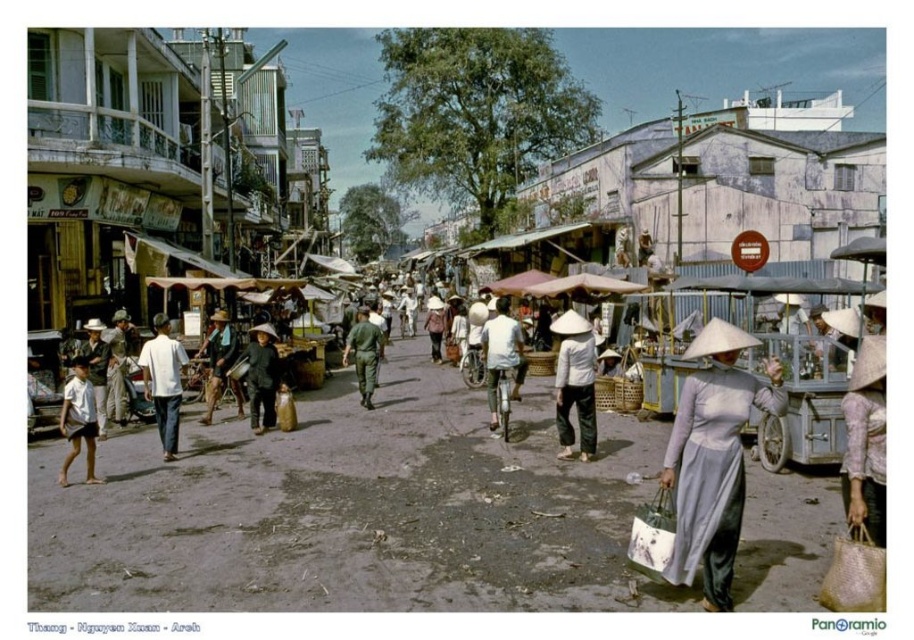
Question: Considering the real-world distances, which object is farthest from the white matte shirt at center?

Choices:
 (A) matte brown hat at center
 (B) light brown straw hat at left
 (C) light brown fabric ao dai at center
 (D) white matte bicycle at center

Answer: (A)

Question: In this image, where is dark blue fabric hat at center located relative to dark brown wooden stick at center?

Choices:
 (A) below
 (B) above

Answer: (B)

Question: Which object is closer to the camera taking this photo?

Choices:
 (A) white cotton ao dai at center
 (B) dark brown wooden stick at center
 (C) light brown straw hat at left

Answer: (A)

Question: Can you confirm if white matte ao dai at center is thinner than green military uniform at center?

Choices:
 (A) yes
 (B) no

Answer: (A)

Question: Is white matte shirt at center bigger than light brown straw hat at left?

Choices:
 (A) no
 (B) yes

Answer: (A)

Question: Which point is closer to the camera?

Choices:
 (A) (588, 346)
 (B) (432, 342)
 (C) (258, 353)
 (D) (89, 333)

Answer: (A)